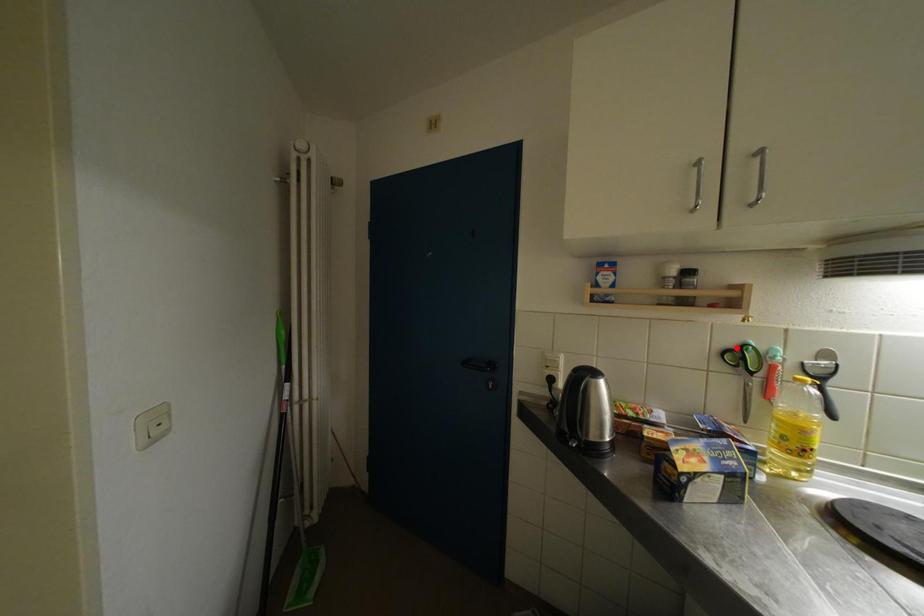
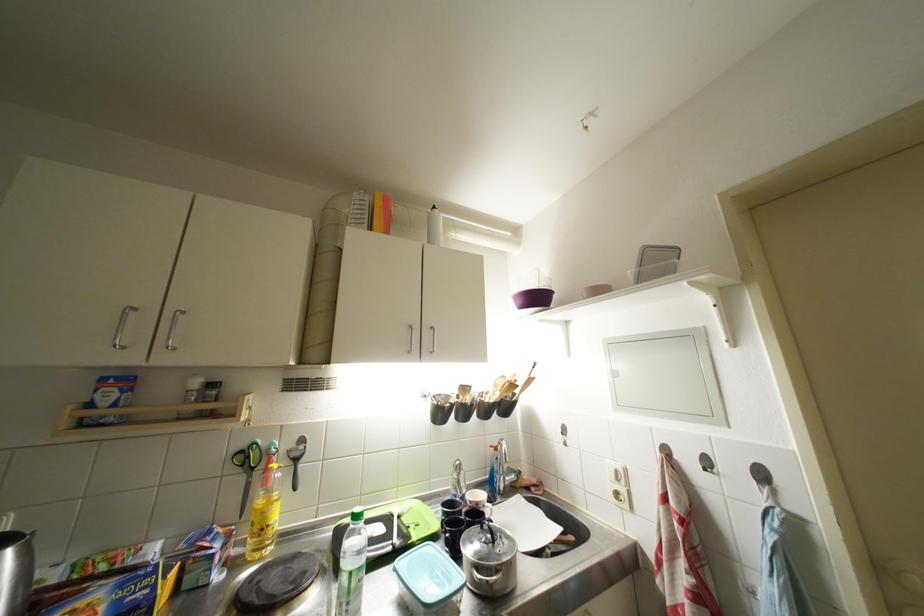
The point at the highlighted location is marked in the first image. Where is the corresponding point in the second image?

(249, 450)